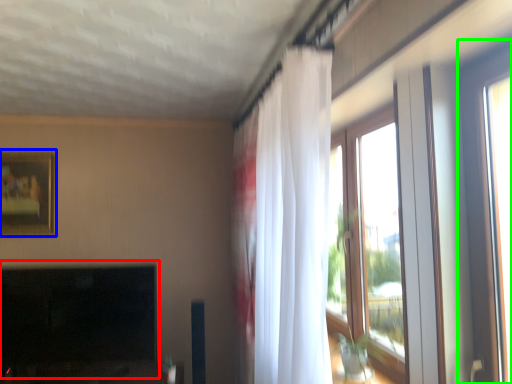
Question: Which object is the closest to the fireplace (highlighted by a red box)? Choose among these: picture frame (highlighted by a blue box) or window (highlighted by a green box).

Choices:
 (A) picture frame
 (B) window

Answer: (A)